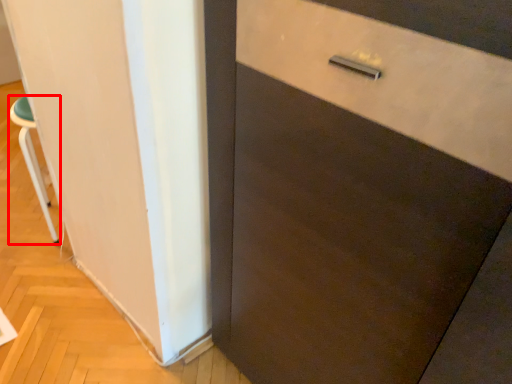
Question: Considering the relative positions of furniture (annotated by the red box) and barn door in the image provided, where is furniture (annotated by the red box) located with respect to the staircase?

Choices:
 (A) right
 (B) left

Answer: (B)